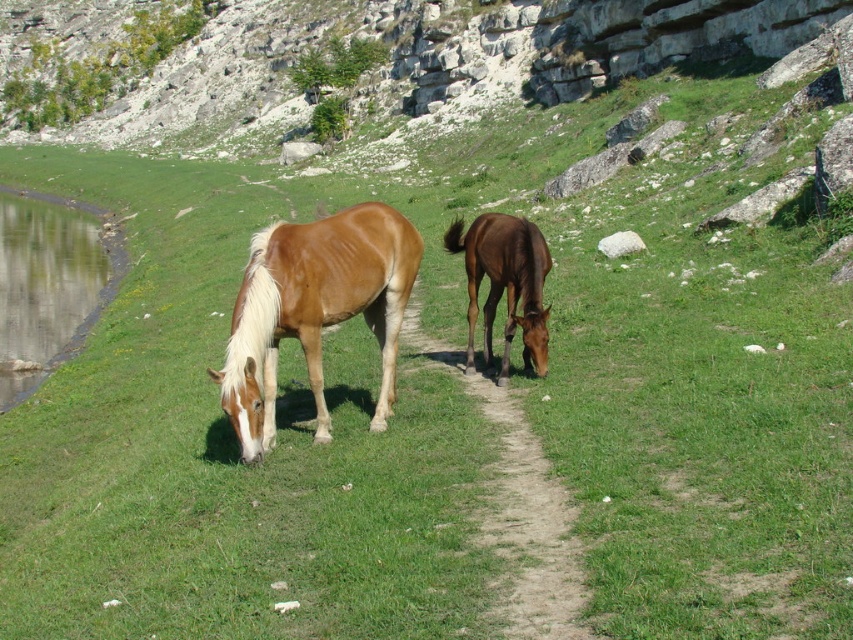
You are standing in the middle of the field in the image and want to walk to both the point at coordinates (294, 90) and the point at coordinates (488, 298). Which point will you reach first?

You will reach point (294, 90) first because it is closer to you than point (488, 298), which is further away.

You are standing at a point in the scene and want to walk towards the point labeled point [154,13]. Which direction should you move relative to point [346,241]?

You should move behind point [346,241] to reach point [154,13] because point [154,13] is located behind point [346,241].